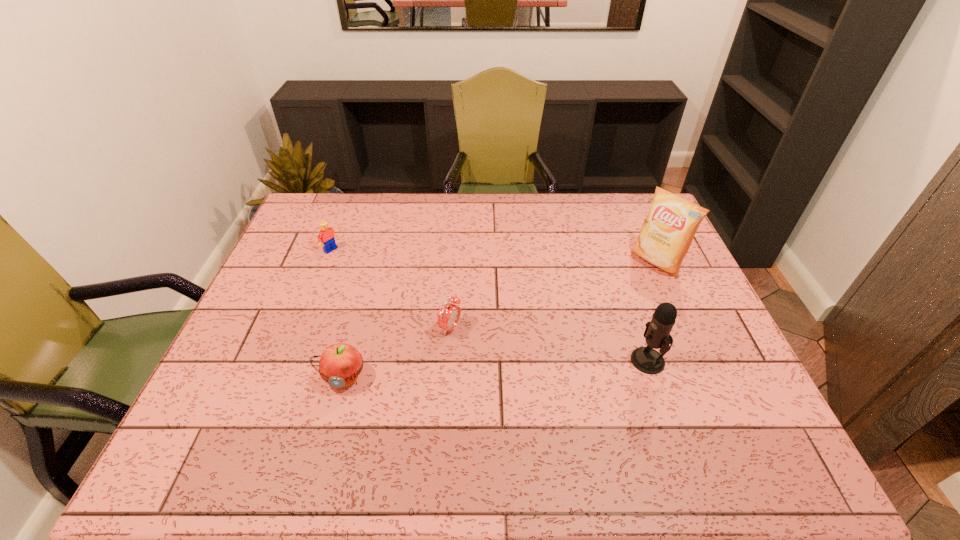
Where is `vacant spot on the desktop that is between the second object from left to right and the microphone and is positioned on the face of the third farthest object`? The image size is (960, 540). vacant spot on the desktop that is between the second object from left to right and the microphone and is positioned on the face of the third farthest object is located at coordinates (539, 367).

Image resolution: width=960 pixels, height=540 pixels. Find the location of `vacant space on the desktop that is between the apple and the microphone and is positioned on the front-facing side of the Lego`. vacant space on the desktop that is between the apple and the microphone and is positioned on the front-facing side of the Lego is located at coordinates (517, 368).

The image size is (960, 540). In order to click on free space on the desktop that is between the apple and the second object from right to left and is positioned on the front-facing side of the crisp (potato chip) in this screenshot , I will do `click(516, 368)`.